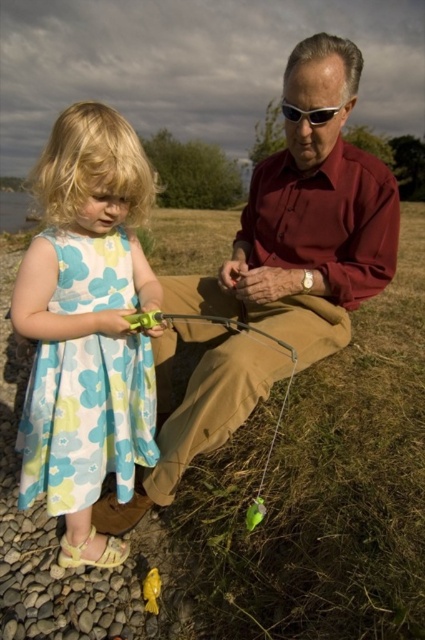
You are standing at the point labeled as point (306, 220) in the image. What object is directly in front of you?

The point labeled as point (306, 220) corresponds to the matte brown trousers at center.